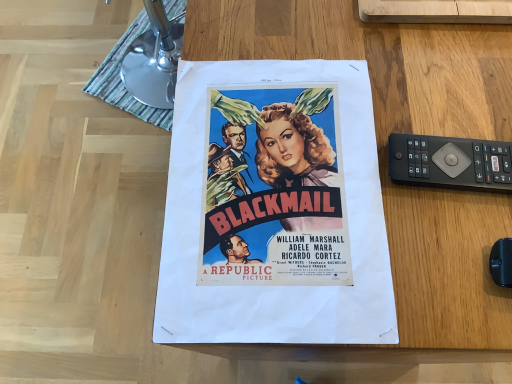
What do you see at coordinates (274, 208) in the screenshot? The width and height of the screenshot is (512, 384). I see `matte paper poster at center` at bounding box center [274, 208].

I want to click on matte paper poster at center, so click(x=274, y=208).

Based on the photo, measure the distance between point (249, 138) and camera.

A distance of 17.09 inches exists between point (249, 138) and camera.

Locate an element on the screen. The image size is (512, 384). matte paper poster at center is located at coordinates (274, 208).